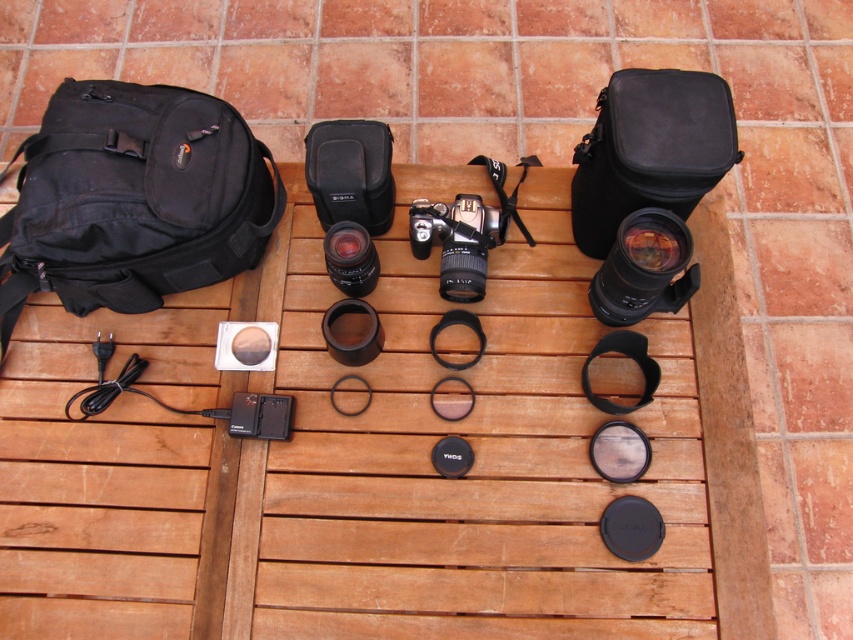
Which is more to the right, wooden at upper center or satin black camera at center?

satin black camera at center

Image resolution: width=853 pixels, height=640 pixels. What are the coordinates of `wooden at upper center` in the screenshot? It's located at (381, 458).

Where is `wooden at upper center`? wooden at upper center is located at coordinates (381, 458).

Which is below, black fabric backpack at upper left or satin black camera at center?

Positioned lower is satin black camera at center.

This screenshot has height=640, width=853. I want to click on black fabric backpack at upper left, so click(x=132, y=198).

Consider the image. Who is positioned more to the left, matte black camera at upper right or satin black camera at center?

Positioned to the left is satin black camera at center.

Looking at this image, who is more distant from viewer, (654, 243) or (479, 196)?

The point (479, 196) is more distant.

Is point (646, 294) farther from viewer compared to point (471, 240)?

No, (646, 294) is in front of (471, 240).

Where is `matte black camera at upper right`? This screenshot has width=853, height=640. matte black camera at upper right is located at coordinates (643, 268).